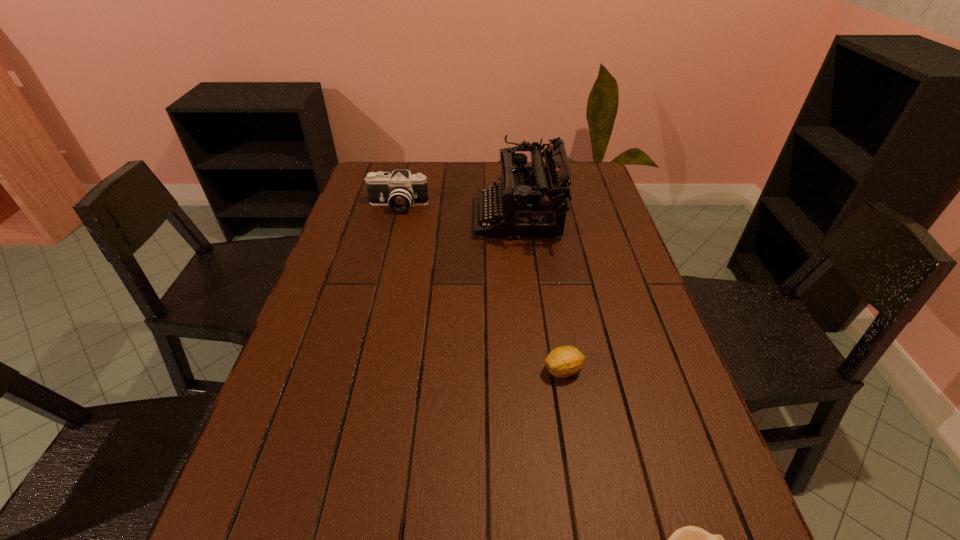
Locate an element on the screen. typewriter is located at coordinates (533, 200).

The height and width of the screenshot is (540, 960). Identify the location of the third shortest object. (401, 190).

Locate an element on the screen. The height and width of the screenshot is (540, 960). camera is located at coordinates (401, 190).

Locate an element on the screen. The image size is (960, 540). the farther lemon is located at coordinates (565, 361).

Image resolution: width=960 pixels, height=540 pixels. What are the coordinates of `the left lemon` in the screenshot? It's located at (565, 361).

The image size is (960, 540). In order to click on free region located on the keyboard of the typewriter in this screenshot , I will do `click(359, 218)`.

I want to click on vacant area situated on the keyboard of the typewriter, so click(403, 218).

Where is `vacant space located on the keyboard of the typewriter`? vacant space located on the keyboard of the typewriter is located at coordinates (437, 218).

Locate an element on the screen. Image resolution: width=960 pixels, height=540 pixels. blank space located on the front of the second tallest object is located at coordinates (393, 224).

In order to click on free location located 0.360m at the stem end of the third tallest object in this screenshot , I will do `click(380, 370)`.